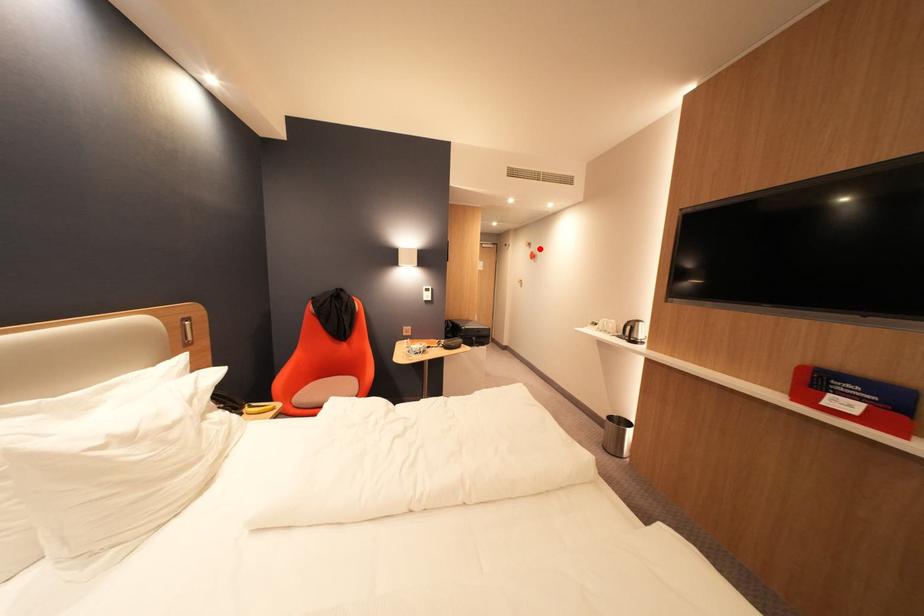
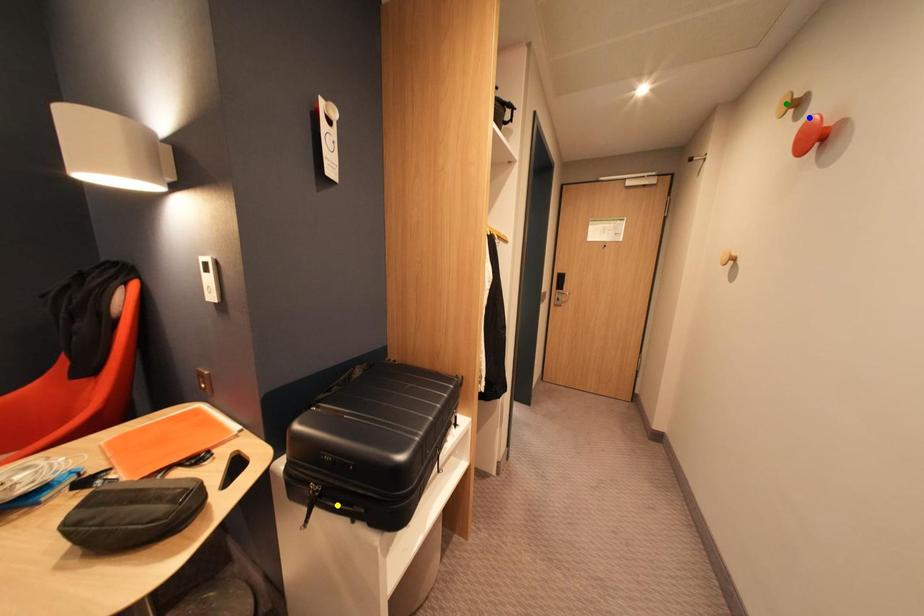
Question: I am providing you with two images of the same scene from different viewpoints. A red point is marked on the first image. You are given multiple points on the second image. Which spot in image 2 lines up with the point in image 1?

Choices:
 (A) yellow point
 (B) green point
 (C) blue point

Answer: (C)